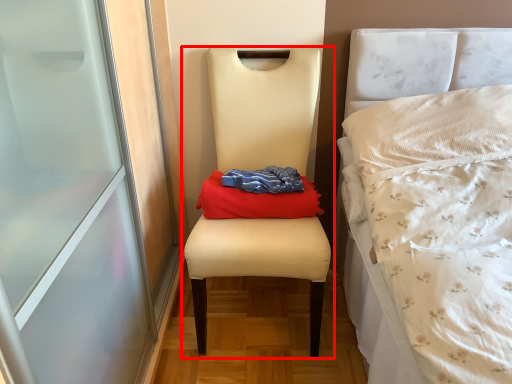
Question: From the image, what is the correct spatial relationship of chair (annotated by the red box) in relation to material?

Choices:
 (A) left
 (B) right

Answer: (A)